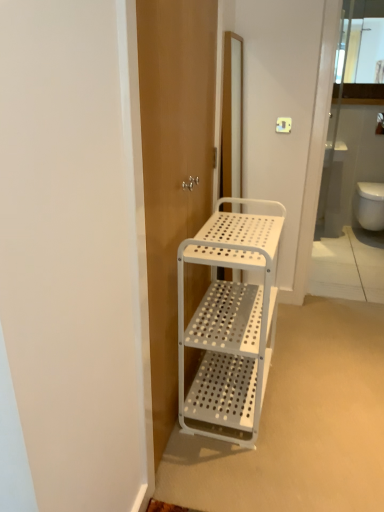
I want to click on free space in front of white perforated metal cart at center, so click(x=258, y=470).